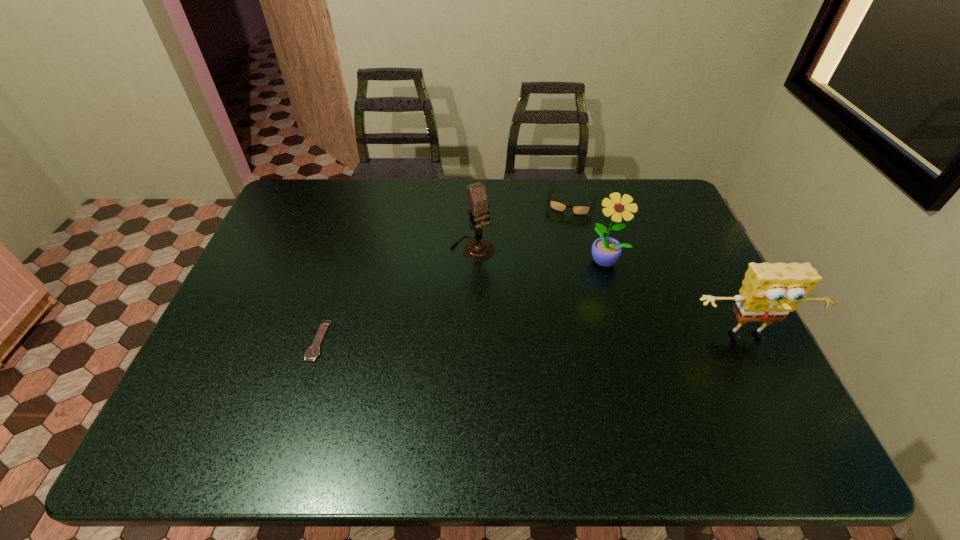
This screenshot has height=540, width=960. In order to click on vacant area that lies between the watch and the fourth object from right to left in this screenshot , I will do `click(396, 294)`.

In order to click on free area in between the rightmost object and the microphone in this screenshot , I will do `click(610, 293)`.

This screenshot has width=960, height=540. I want to click on vacant region between the microphone and the sunglasses, so click(x=522, y=224).

The width and height of the screenshot is (960, 540). Find the location of `vacant space that's between the sunflower and the second object from left to right`. vacant space that's between the sunflower and the second object from left to right is located at coordinates (539, 254).

Where is `vacant area that lies between the leftmost object and the second object from left to right`? This screenshot has width=960, height=540. vacant area that lies between the leftmost object and the second object from left to right is located at coordinates (396, 294).

The height and width of the screenshot is (540, 960). I want to click on the fourth closest object to the farthest object, so click(x=313, y=351).

Where is `object that is the second closest to the sponge`? This screenshot has width=960, height=540. object that is the second closest to the sponge is located at coordinates (559, 206).

The width and height of the screenshot is (960, 540). In order to click on vacant space that satisfies the following two spatial constraints: 1. on the back side of the fourth object from right to left; 2. on the right side of the fourth tallest object in this screenshot , I will do `click(473, 199)`.

Find the location of a particular element. Image resolution: width=960 pixels, height=540 pixels. free location that satisfies the following two spatial constraints: 1. on the back side of the fourth object from right to left; 2. on the left side of the farthest object is located at coordinates (473, 199).